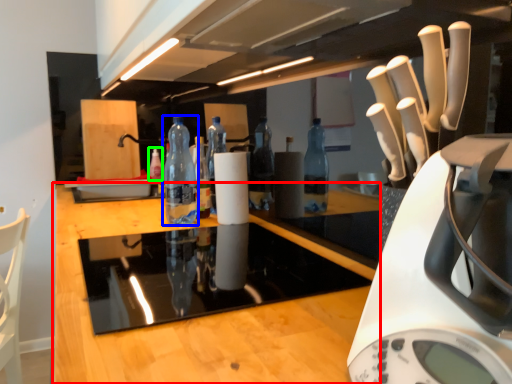
Question: Considering the real-world distances, which object is closest to countertop (highlighted by a red box)? bottle (highlighted by a blue box) or bottle (highlighted by a green box).

Choices:
 (A) bottle
 (B) bottle

Answer: (A)